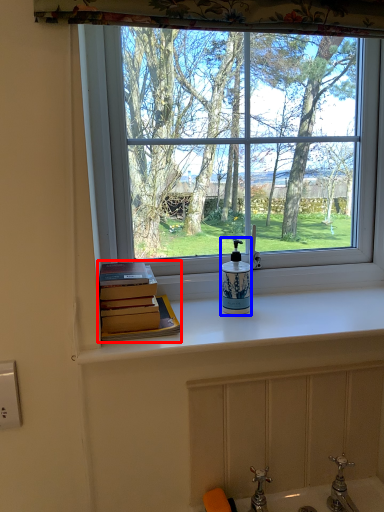
Question: Which object appears closest to the camera in this image, book (highlighted by a red box) or soap dispenser (highlighted by a blue box)?

Choices:
 (A) book
 (B) soap dispenser

Answer: (A)